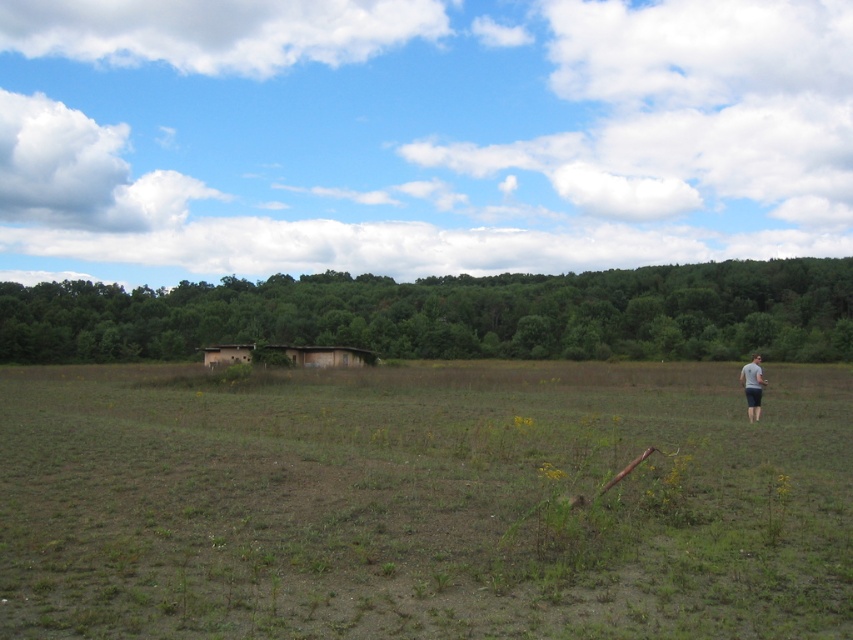
Question: Which object is positioned closest to the brown wooden hut at center?

Choices:
 (A) brown dry grass at center
 (B) gray fabric shirt at right

Answer: (A)

Question: Can you confirm if brown wooden hut at center is wider than gray fabric shirt at right?

Choices:
 (A) no
 (B) yes

Answer: (A)

Question: Which point is closer to the camera taking this photo?

Choices:
 (A) (741, 371)
 (B) (827, 451)

Answer: (B)

Question: Based on their relative distances, which object is farther from the brown wooden hut at center?

Choices:
 (A) brown dry grass at center
 (B) gray fabric shirt at right

Answer: (B)

Question: Is brown dry grass at center below brown wooden hut at center?

Choices:
 (A) no
 (B) yes

Answer: (B)

Question: Does brown dry grass at center lie in front of brown wooden hut at center?

Choices:
 (A) no
 (B) yes

Answer: (B)